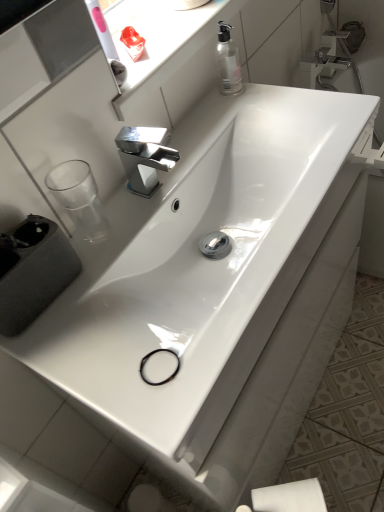
Question: Can you confirm if white glossy sink at center, which is the second sink from back to front, is shorter than white glossy sink at center, placed as the second sink when sorted from front to back?

Choices:
 (A) no
 (B) yes

Answer: (A)

Question: Is white glossy sink at center, the first sink viewed from the front, outside of white glossy sink at center, placed as the second sink when sorted from front to back?

Choices:
 (A) yes
 (B) no

Answer: (A)

Question: Is white glossy sink at center, which is the second sink from back to front, at the left side of white glossy sink at center, placed as the second sink when sorted from front to back?

Choices:
 (A) no
 (B) yes

Answer: (A)

Question: Is white glossy sink at center, which is the second sink from back to front, not near white glossy sink at center, arranged as the 1th sink when viewed from the back?

Choices:
 (A) no
 (B) yes

Answer: (A)

Question: Is white glossy sink at center, which is the second sink from back to front, positioned with its back to white glossy sink at center, arranged as the 1th sink when viewed from the back?

Choices:
 (A) yes
 (B) no

Answer: (B)

Question: Is point (216, 65) closer or farther from the camera than point (299, 500)?

Choices:
 (A) closer
 (B) farther

Answer: (B)

Question: Is transparent plastic soap dispenser at upper right inside the boundaries of white matte toilet paper at lower right, or outside?

Choices:
 (A) outside
 (B) inside

Answer: (A)

Question: Relative to white matte toilet paper at lower right, is transparent plastic soap dispenser at upper right in front or behind?

Choices:
 (A) behind
 (B) front

Answer: (A)

Question: In terms of size, does transparent plastic soap dispenser at upper right appear bigger or smaller than white matte toilet paper at lower right?

Choices:
 (A) small
 (B) big

Answer: (A)

Question: Would you say white matte toilet paper at lower right is inside or outside transparent plastic window sill at upper center?

Choices:
 (A) inside
 (B) outside

Answer: (B)

Question: Looking at their shapes, would you say white matte toilet paper at lower right is wider or thinner than transparent plastic window sill at upper center?

Choices:
 (A) wide
 (B) thin

Answer: (B)

Question: Is white matte toilet paper at lower right bigger or smaller than transparent plastic window sill at upper center?

Choices:
 (A) big
 (B) small

Answer: (B)

Question: In the image, is white matte toilet paper at lower right on the left side or the right side of transparent plastic window sill at upper center?

Choices:
 (A) left
 (B) right

Answer: (B)

Question: Relative to transparent plastic window sill at upper center, is white glossy sink at center, the first sink viewed from the front, in front or behind?

Choices:
 (A) behind
 (B) front

Answer: (B)

Question: Based on their positions, is white glossy sink at center, which is the second sink from back to front, located to the left or right of transparent plastic window sill at upper center?

Choices:
 (A) right
 (B) left

Answer: (A)